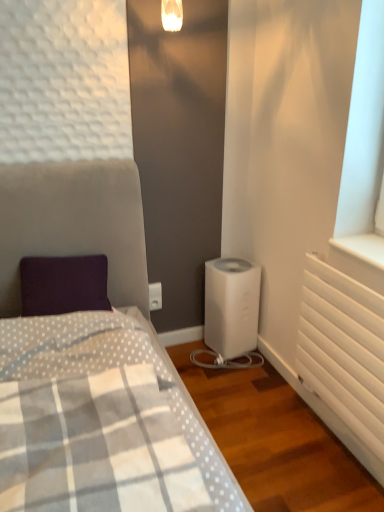
At what (x,y) coordinates should I click in order to perform the action: click on white plastic electric outlet at center. Please return your answer as a coordinate pair (x, y). This screenshot has width=384, height=512. Looking at the image, I should click on (155, 296).

What is the approximate height of white matte radiator at right?

24.99 inches.

At what (x,y) coordinates should I click in order to perform the action: click on white plastic water heater at lower center. Please return your answer as a coordinate pair (x, y). This screenshot has height=512, width=384. Looking at the image, I should click on (231, 306).

Find the location of a particular element. The width and height of the screenshot is (384, 512). white plastic electric outlet at center is located at coordinates (155, 296).

Image resolution: width=384 pixels, height=512 pixels. What are the coordinates of `electric outlet behind the white matte radiator at right` in the screenshot? It's located at (155, 296).

In terms of size, does white matte radiator at right appear bigger or smaller than white plastic electric outlet at center?

white matte radiator at right is bigger than white plastic electric outlet at center.

Is white matte radiator at right inside or outside of white plastic electric outlet at center?

white matte radiator at right is located beyond the bounds of white plastic electric outlet at center.

Are white matte radiator at right and white plastic electric outlet at center located far from each other?

white matte radiator at right is near white plastic electric outlet at center, not far away.

Considering the sizes of objects white plastic electric outlet at center and white plastic water heater at lower center in the image provided, who is smaller, white plastic electric outlet at center or white plastic water heater at lower center?

white plastic electric outlet at center is smaller.

In the scene shown: Is there a large distance between white plastic electric outlet at center and white plastic water heater at lower center?

No, there isn't a large distance between white plastic electric outlet at center and white plastic water heater at lower center.

From the picture: Considering the sizes of objects white plastic electric outlet at center and white plastic water heater at lower center in the image provided, who is taller, white plastic electric outlet at center or white plastic water heater at lower center?

Standing taller between the two is white plastic water heater at lower center.

From a real-world perspective, is white plastic electric outlet at center under white plastic water heater at lower center?

No, from a real-world perspective, white plastic electric outlet at center is not below white plastic water heater at lower center.

Is the position of white matte radiator at right more distant than that of white plastic water heater at lower center?

No, it is not.

How many degrees apart are the facing directions of white matte radiator at right and white plastic water heater at lower center?

The facing directions of white matte radiator at right and white plastic water heater at lower center are 102 degrees apart.

Does white matte radiator at right have a smaller size compared to white plastic water heater at lower center?

Indeed, white matte radiator at right has a smaller size compared to white plastic water heater at lower center.

Would you say white plastic electric outlet at center is a long distance from white matte radiator at right?

No, white plastic electric outlet at center is not far away from white matte radiator at right.

Is white plastic electric outlet at center in front of or behind white matte radiator at right in the image?

white plastic electric outlet at center is behind white matte radiator at right.

In the scene shown: From the image's perspective, which one is positioned higher, white plastic electric outlet at center or white matte radiator at right?

From the image's view, white plastic electric outlet at center is above.

Is white plastic water heater at lower center located outside white plastic electric outlet at center?

Yes, white plastic water heater at lower center is located beyond the bounds of white plastic electric outlet at center.

Can you confirm if white plastic water heater at lower center is wider than white plastic electric outlet at center?

Indeed, white plastic water heater at lower center has a greater width compared to white plastic electric outlet at center.

Is white plastic water heater at lower center next to white plastic electric outlet at center?

No, white plastic water heater at lower center is not touching white plastic electric outlet at center.

From a real-world perspective, between white plastic water heater at lower center and white plastic electric outlet at center, who is vertically higher?

In real-world perspective, white plastic electric outlet at center is above.

How much distance is there between white plastic water heater at lower center and white matte radiator at right?

white plastic water heater at lower center and white matte radiator at right are 23.94 inches apart from each other.

In terms of width, does white plastic water heater at lower center look wider or thinner when compared to white matte radiator at right?

white plastic water heater at lower center is wider than white matte radiator at right.

From the image's perspective, which one is positioned higher, white plastic water heater at lower center or white matte radiator at right?

white plastic water heater at lower center is shown above in the image.

What are the coordinates of `radiator on the right of white plastic electric outlet at center` in the screenshot? It's located at (344, 349).

Where is `electric outlet that appears above the white plastic water heater at lower center (from a real-world perspective)`? The height and width of the screenshot is (512, 384). electric outlet that appears above the white plastic water heater at lower center (from a real-world perspective) is located at coordinates (155, 296).

Considering their positions, is white plastic water heater at lower center positioned further to white matte radiator at right than white plastic electric outlet at center?

Based on the image, white plastic electric outlet at center appears to be further to white matte radiator at right.

Based on their spatial positions, is white plastic electric outlet at center or white matte radiator at right closer to white plastic water heater at lower center?

white plastic electric outlet at center lies closer to white plastic water heater at lower center than the other object.

Estimate the real-world distances between objects in this image. Which object is further from white matte radiator at right, white plastic electric outlet at center or white plastic water heater at lower center?

white plastic electric outlet at center.

When comparing their distances from white plastic water heater at lower center, does white matte radiator at right or white plastic electric outlet at center seem further?

white matte radiator at right is positioned further to the anchor white plastic water heater at lower center.

Estimate the real-world distances between objects in this image. Which object is closer to white plastic electric outlet at center, white plastic water heater at lower center or white matte radiator at right?

white plastic water heater at lower center is positioned closer to the anchor white plastic electric outlet at center.

From the image, which object appears to be farther from white plastic electric outlet at center, white matte radiator at right or white plastic water heater at lower center?

white matte radiator at right is positioned further to the anchor white plastic electric outlet at center.

Find the location of a particular element. This screenshot has width=384, height=512. water heater between white matte radiator at right and white plastic electric outlet at center from front to back is located at coordinates (231, 306).